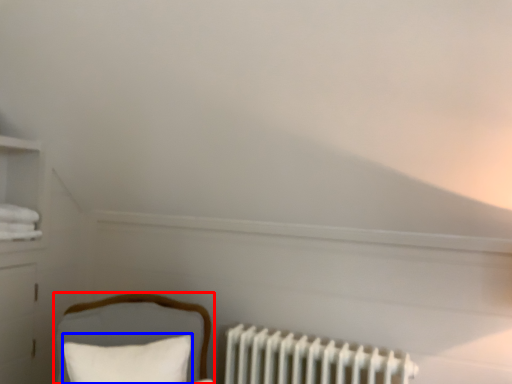
Question: Among these objects, which one is farthest to the camera, furniture (highlighted by a red box) or pillow (highlighted by a blue box)?

Choices:
 (A) furniture
 (B) pillow

Answer: (B)